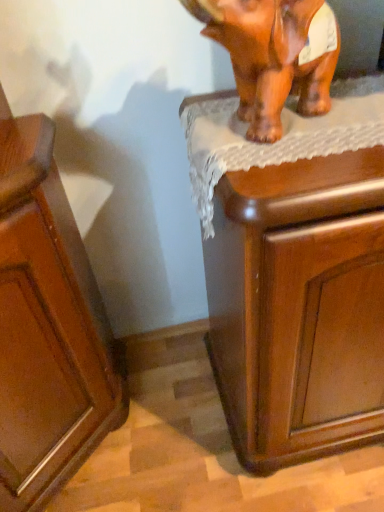
The image size is (384, 512). Describe the element at coordinates (274, 55) in the screenshot. I see `brown glossy elephant at upper right` at that location.

From the picture: In order to face brown glossy elephant at upper right, should I rotate leftwards or rightwards?

You should rotate right by 10.882 degrees.

Where is `brown glossy elephant at upper right`? brown glossy elephant at upper right is located at coordinates point(274,55).

Is point (70, 218) farther from viewer compared to point (219, 263)?

That is True.

Is wooden cabinet at upper right at the back of glossy wood cabinet at lower left?

No, glossy wood cabinet at lower left is not facing the opposite direction of wooden cabinet at upper right.

Consider the image. What's the angular difference between glossy wood cabinet at lower left and wooden cabinet at upper right's facing directions?

42.5 degrees.

Considering the sizes of glossy wood cabinet at lower left and wooden cabinet at upper right in the image, is glossy wood cabinet at lower left bigger or smaller than wooden cabinet at upper right?

glossy wood cabinet at lower left is smaller than wooden cabinet at upper right.

How many degrees apart are the facing directions of wooden cabinet at upper right and brown glossy elephant at upper right?

23.5 degrees separate the facing orientations of wooden cabinet at upper right and brown glossy elephant at upper right.

Considering the points (235, 391) and (325, 34), which point is in front, point (235, 391) or point (325, 34)?

Point (325, 34)

Can you confirm if wooden cabinet at upper right is positioned to the left of brown glossy elephant at upper right?

Incorrect, wooden cabinet at upper right is not on the left side of brown glossy elephant at upper right.

Is wooden cabinet at upper right in front of brown glossy elephant at upper right?

No, it is behind brown glossy elephant at upper right.

Is wooden cabinet at upper right inside or outside of glossy wood cabinet at lower left?

wooden cabinet at upper right cannot be found inside glossy wood cabinet at lower left.

The image size is (384, 512). Find the location of `chest of drawers on the right of glossy wood cabinet at lower left`. chest of drawers on the right of glossy wood cabinet at lower left is located at coordinates (299, 307).

Is the surface of wooden cabinet at upper right in direct contact with glossy wood cabinet at lower left?

No, wooden cabinet at upper right is not with glossy wood cabinet at lower left.

Considering the sizes of objects wooden cabinet at upper right and glossy wood cabinet at lower left in the image provided, who is bigger, wooden cabinet at upper right or glossy wood cabinet at lower left?

Bigger between the two is wooden cabinet at upper right.

Is brown glossy elephant at upper right facing towards glossy wood cabinet at lower left?

No, brown glossy elephant at upper right is not oriented towards glossy wood cabinet at lower left.

From the image's perspective, between brown glossy elephant at upper right and glossy wood cabinet at lower left, who is located below?

From the image's view, glossy wood cabinet at lower left is below.

In the scene shown: Considering the relative positions of brown glossy elephant at upper right and glossy wood cabinet at lower left in the image provided, is brown glossy elephant at upper right to the left or to the right of glossy wood cabinet at lower left?

Based on their positions, brown glossy elephant at upper right is located to the right of glossy wood cabinet at lower left.

Considering the relative sizes of brown glossy elephant at upper right and glossy wood cabinet at lower left in the image provided, is brown glossy elephant at upper right shorter than glossy wood cabinet at lower left?

Indeed, brown glossy elephant at upper right has a lesser height compared to glossy wood cabinet at lower left.

Can you confirm if glossy wood cabinet at lower left is taller than brown glossy elephant at upper right?

Correct, glossy wood cabinet at lower left is much taller as brown glossy elephant at upper right.

From the image's perspective, is glossy wood cabinet at lower left under brown glossy elephant at upper right?

Yes, from the image's perspective, glossy wood cabinet at lower left is beneath brown glossy elephant at upper right.

Is point (48, 282) in front of point (238, 42)?

No, (48, 282) is behind (238, 42).

From a real-world perspective, between glossy wood cabinet at lower left and brown glossy elephant at upper right, who is vertically higher?

brown glossy elephant at upper right.

Can you tell me how much brown glossy elephant at upper right and wooden cabinet at upper right differ in facing direction?

23.5 degrees separate the facing orientations of brown glossy elephant at upper right and wooden cabinet at upper right.

At what (x,y) coordinates should I click in order to perform the action: click on elephant above the wooden cabinet at upper right (from a real-world perspective). Please return your answer as a coordinate pair (x, y). The image size is (384, 512). Looking at the image, I should click on (274, 55).

Considering the positions of points (274, 13) and (349, 371), is point (274, 13) farther from camera compared to point (349, 371)?

No, (274, 13) is in front of (349, 371).

From their relative heights in the image, would you say brown glossy elephant at upper right is taller or shorter than wooden cabinet at upper right?

In the image, brown glossy elephant at upper right appears to be shorter than wooden cabinet at upper right.

This screenshot has width=384, height=512. I want to click on cabinetry above the wooden cabinet at upper right (from a real-world perspective), so click(47, 326).

This screenshot has height=512, width=384. In the image, there is a brown glossy elephant at upper right. Find the location of `the chest of drawers below it (from the image's perspective)`. the chest of drawers below it (from the image's perspective) is located at coordinates (299, 307).

When comparing their distances from brown glossy elephant at upper right, does wooden cabinet at upper right or glossy wood cabinet at lower left seem closer?

Among the two, wooden cabinet at upper right is located nearer to brown glossy elephant at upper right.

Looking at the image, which one is located closer to glossy wood cabinet at lower left, brown glossy elephant at upper right or wooden cabinet at upper right?

wooden cabinet at upper right is closer to glossy wood cabinet at lower left.

Which object lies nearer to the anchor point brown glossy elephant at upper right, glossy wood cabinet at lower left or wooden cabinet at upper right?

Among the two, wooden cabinet at upper right is located nearer to brown glossy elephant at upper right.

Looking at the image, which one is located closer to glossy wood cabinet at lower left, wooden cabinet at upper right or brown glossy elephant at upper right?

The object closer to glossy wood cabinet at lower left is wooden cabinet at upper right.

Considering their positions, is brown glossy elephant at upper right positioned closer to wooden cabinet at upper right than glossy wood cabinet at lower left?

Based on the image, brown glossy elephant at upper right appears to be nearer to wooden cabinet at upper right.

Based on the photo, looking at the image, which one is located further to wooden cabinet at upper right, glossy wood cabinet at lower left or brown glossy elephant at upper right?

glossy wood cabinet at lower left is positioned further to the anchor wooden cabinet at upper right.

Where is `elephant situated between glossy wood cabinet at lower left and wooden cabinet at upper right from left to right`? Image resolution: width=384 pixels, height=512 pixels. elephant situated between glossy wood cabinet at lower left and wooden cabinet at upper right from left to right is located at coordinates (274, 55).